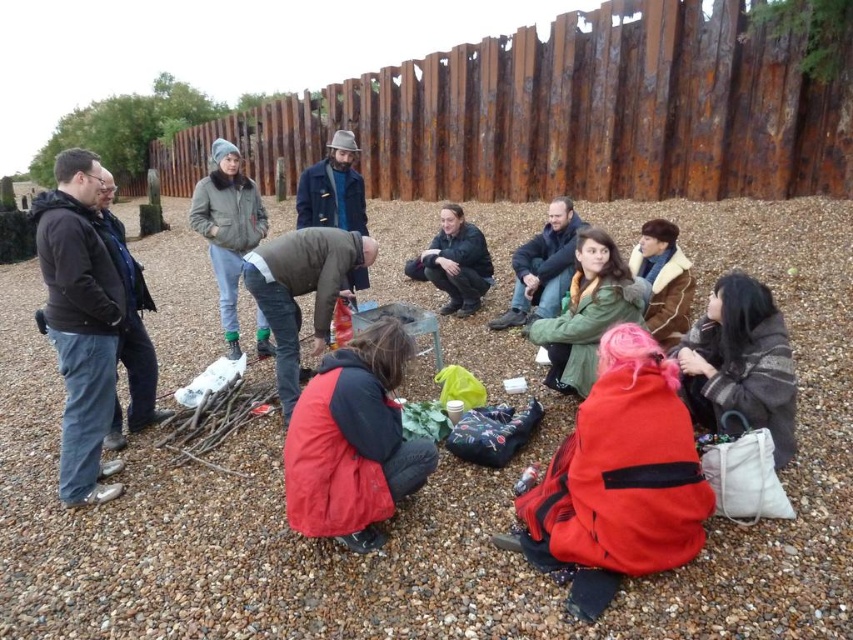
Who is lower down, gray fuzzy jacket at center or black jacket at left?

black jacket at left is below.

Is gray fuzzy jacket at center to the right of black jacket at left from the viewer's perspective?

No, gray fuzzy jacket at center is not to the right of black jacket at left.

Find the location of a particular element. The height and width of the screenshot is (640, 853). gray fuzzy jacket at center is located at coordinates (227, 227).

Can you confirm if red matte jacket at lower center is positioned above green matte jacket at center?

No, red matte jacket at lower center is not above green matte jacket at center.

Between red matte jacket at lower center and green matte jacket at center, which one appears on the right side from the viewer's perspective?

Positioned to the right is green matte jacket at center.

Who is more forward, (349, 358) or (643, 301)?

Positioned in front is point (349, 358).

The image size is (853, 640). I want to click on red matte jacket at lower center, so click(352, 442).

Does matte black jacket at center have a larger size compared to brown fuzzy coat at center?

Yes, matte black jacket at center is bigger than brown fuzzy coat at center.

Is matte black jacket at center positioned behind brown fuzzy coat at center?

Yes.

Find the location of a particular element. matte black jacket at center is located at coordinates (456, 262).